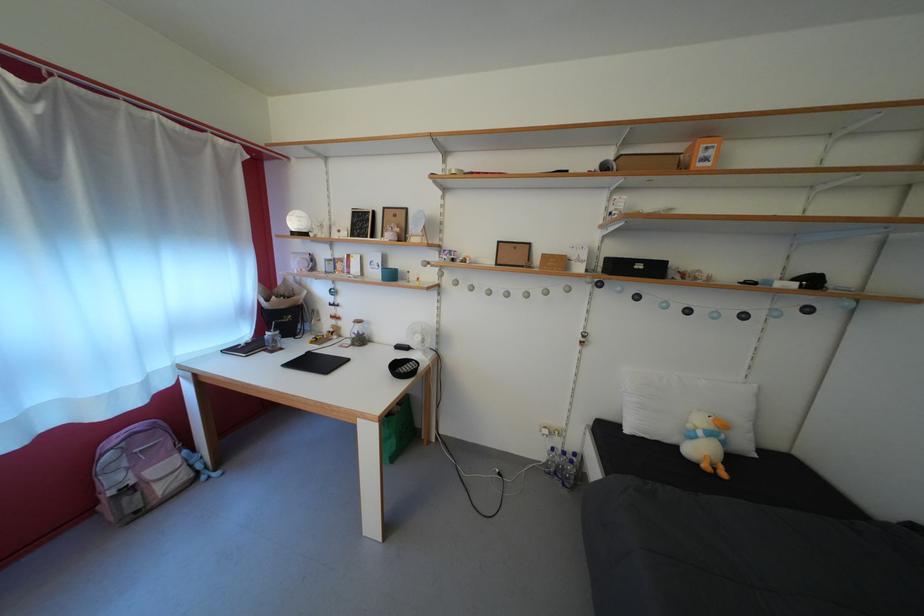
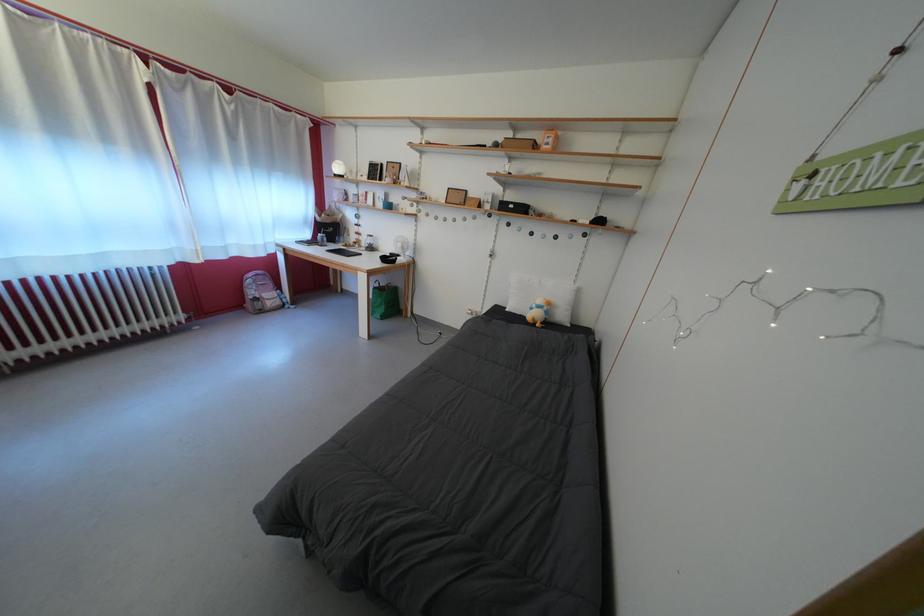
Locate, in the second image, the point that corresponds to point (427, 344) in the first image.

(407, 251)